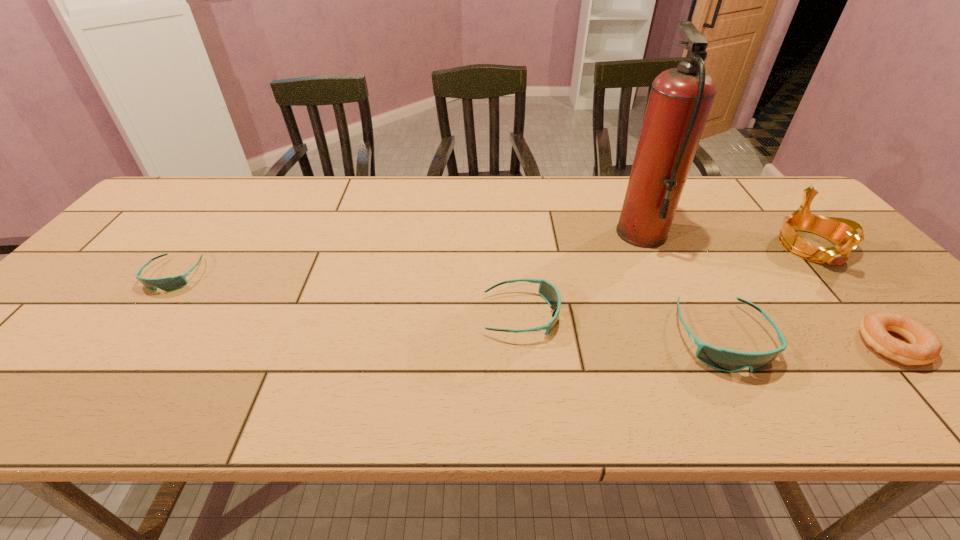
The width and height of the screenshot is (960, 540). In order to click on free space that satisfies the following two spatial constraints: 1. on the front-facing side of the shortest sunglasses; 2. on the left side of the bagel in this screenshot , I will do `click(121, 345)`.

You are a GUI agent. You are given a task and a screenshot of the screen. Output one action in this format:
    pyautogui.click(x=<x>, y=<y>)
    Task: Click on the free space that satisfies the following two spatial constraints: 1. on the front-facing side of the leftmost object; 2. on the left side of the bagel
    The height and width of the screenshot is (540, 960).
    Given the screenshot: What is the action you would take?
    pyautogui.click(x=121, y=345)

Where is `free spot that satisfies the following two spatial constraints: 1. on the front-facing side of the third tallest object; 2. on the left side of the bagel`? free spot that satisfies the following two spatial constraints: 1. on the front-facing side of the third tallest object; 2. on the left side of the bagel is located at coordinates (726, 345).

Locate an element on the screen. The width and height of the screenshot is (960, 540). free space that satisfies the following two spatial constraints: 1. at the nozzle of the bagel; 2. on the right side of the tallest object is located at coordinates (692, 345).

Where is `free space that satisfies the following two spatial constraints: 1. on the front-facing side of the bagel; 2. on the left side of the second object from left to right`? The height and width of the screenshot is (540, 960). free space that satisfies the following two spatial constraints: 1. on the front-facing side of the bagel; 2. on the left side of the second object from left to right is located at coordinates (524, 345).

Where is `vacant area that satisfies the following two spatial constraints: 1. on the front-facing side of the bagel; 2. on the right side of the leftmost sunglasses`? This screenshot has width=960, height=540. vacant area that satisfies the following two spatial constraints: 1. on the front-facing side of the bagel; 2. on the right side of the leftmost sunglasses is located at coordinates (121, 345).